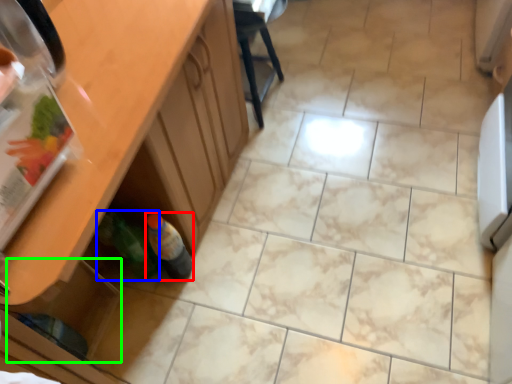
Question: Which object is positioned closest to bottle (highlighted by a red box)? Select from bottle (highlighted by a blue box) and drawer (highlighted by a green box).

Choices:
 (A) bottle
 (B) drawer

Answer: (A)